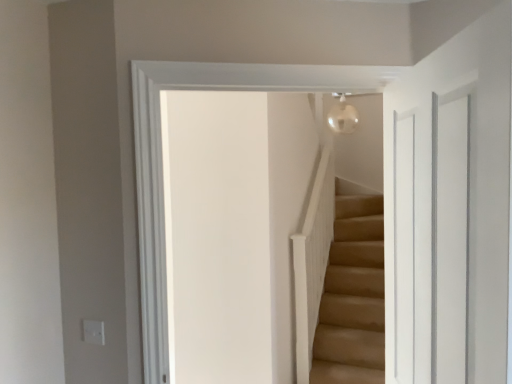
Question: Does transparent glass door at right have a larger size compared to white matte balustrade at upper center?

Choices:
 (A) yes
 (B) no

Answer: (B)

Question: Does transparent glass door at right appear on the left side of white matte balustrade at upper center?

Choices:
 (A) no
 (B) yes

Answer: (B)

Question: Is the surface of transparent glass door at right in direct contact with white matte balustrade at upper center?

Choices:
 (A) no
 (B) yes

Answer: (A)

Question: From the image's perspective, would you say transparent glass door at right is positioned over white matte balustrade at upper center?

Choices:
 (A) yes
 (B) no

Answer: (A)

Question: Is transparent glass door at right taller than white matte balustrade at upper center?

Choices:
 (A) yes
 (B) no

Answer: (B)

Question: From a real-world perspective, is transparent glass door at right located higher than white matte balustrade at upper center?

Choices:
 (A) yes
 (B) no

Answer: (A)

Question: Does white matte balustrade at upper center have a greater height compared to transparent glass door at right?

Choices:
 (A) no
 (B) yes

Answer: (B)

Question: Can you confirm if white matte balustrade at upper center is thinner than transparent glass door at right?

Choices:
 (A) no
 (B) yes

Answer: (A)

Question: From the image's perspective, is white matte balustrade at upper center located above transparent glass door at right?

Choices:
 (A) no
 (B) yes

Answer: (A)

Question: Considering the relative positions of white matte balustrade at upper center and transparent glass door at right in the image provided, is white matte balustrade at upper center behind transparent glass door at right?

Choices:
 (A) yes
 (B) no

Answer: (A)

Question: From the image's perspective, does white matte balustrade at upper center appear lower than transparent glass door at right?

Choices:
 (A) yes
 (B) no

Answer: (A)

Question: From a real-world perspective, does white matte balustrade at upper center stand above transparent glass door at right?

Choices:
 (A) yes
 (B) no

Answer: (B)

Question: Is white matte balustrade at upper center taller or shorter than transparent glass door at right?

Choices:
 (A) tall
 (B) short

Answer: (A)